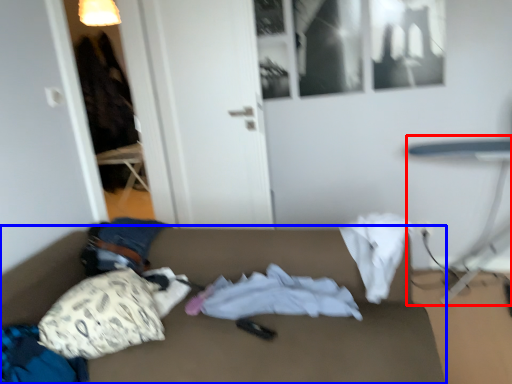
Question: Which object appears closest to the camera in this image, table (highlighted by a red box) or studio couch (highlighted by a blue box)?

Choices:
 (A) table
 (B) studio couch

Answer: (B)